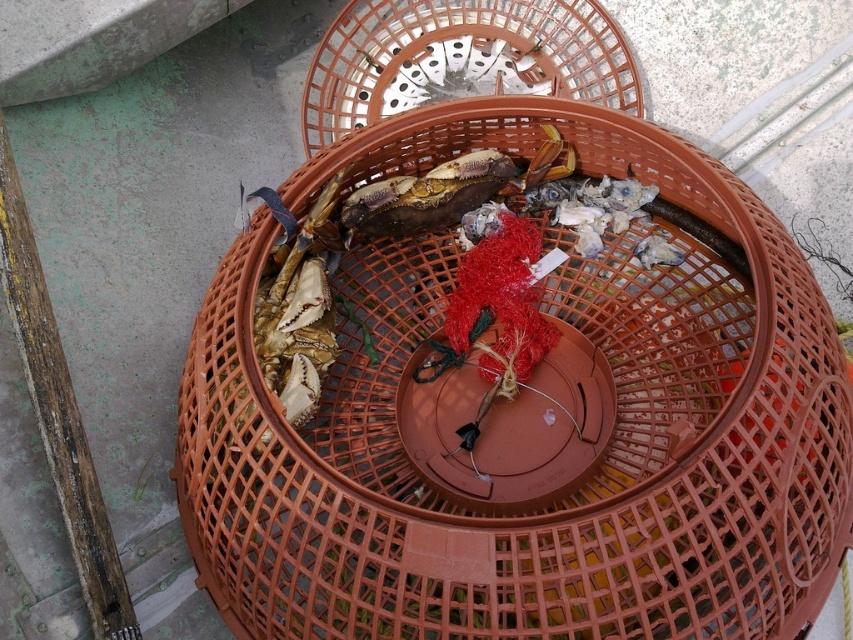
Consider the image. Between brown plastic basket at center and translucent plastic basket at center, which one appears on the left side from the viewer's perspective?

translucent plastic basket at center

Does brown plastic basket at center have a smaller size compared to translucent plastic basket at center?

Incorrect, brown plastic basket at center is not smaller in size than translucent plastic basket at center.

The height and width of the screenshot is (640, 853). What are the coordinates of `brown plastic basket at center` in the screenshot? It's located at (573, 480).

Looking at this image, is brown plastic basket at center to the left of shiny brown crab at center from the viewer's perspective?

Incorrect, brown plastic basket at center is not on the left side of shiny brown crab at center.

Consider the image. Measure the distance from brown plastic basket at center to shiny brown crab at center.

The distance of brown plastic basket at center from shiny brown crab at center is 15.02 inches.

This screenshot has width=853, height=640. Describe the element at coordinates (573, 480) in the screenshot. I see `brown plastic basket at center` at that location.

At what (x,y) coordinates should I click in order to perform the action: click on brown plastic basket at center. Please return your answer as a coordinate pair (x, y). The image size is (853, 640). Looking at the image, I should click on (573, 480).

Find the location of a particular element. The image size is (853, 640). translucent plastic basket at center is located at coordinates [461, 58].

Between translucent plastic basket at center and shiny brown crab at center, which one appears on the left side from the viewer's perspective?

From the viewer's perspective, shiny brown crab at center appears more on the left side.

Where is `translucent plastic basket at center`? translucent plastic basket at center is located at coordinates pos(461,58).

Identify the location of translucent plastic basket at center. 461,58.